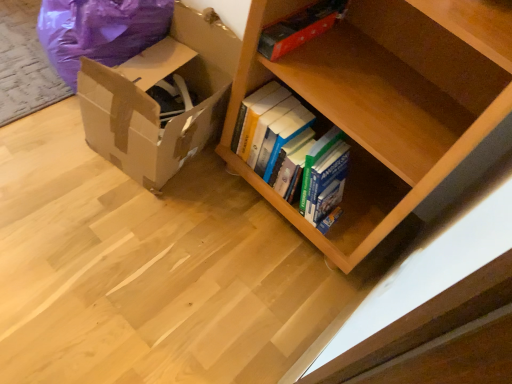
Where is `spots to the right of brown cardboard box at lower left`? spots to the right of brown cardboard box at lower left is located at coordinates (229, 205).